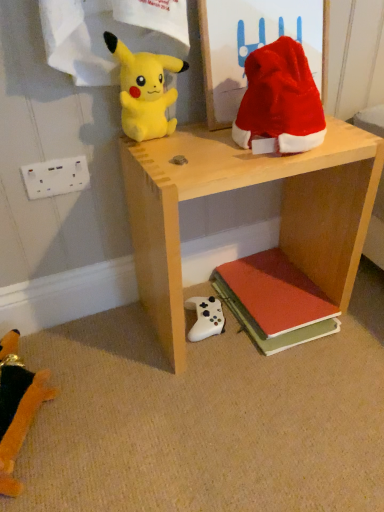
The height and width of the screenshot is (512, 384). I want to click on free space between velvet orange stuffed toy at lower left, which ranks as the fourth toy in right-to-left order, and red matte book at lower right, so click(x=150, y=370).